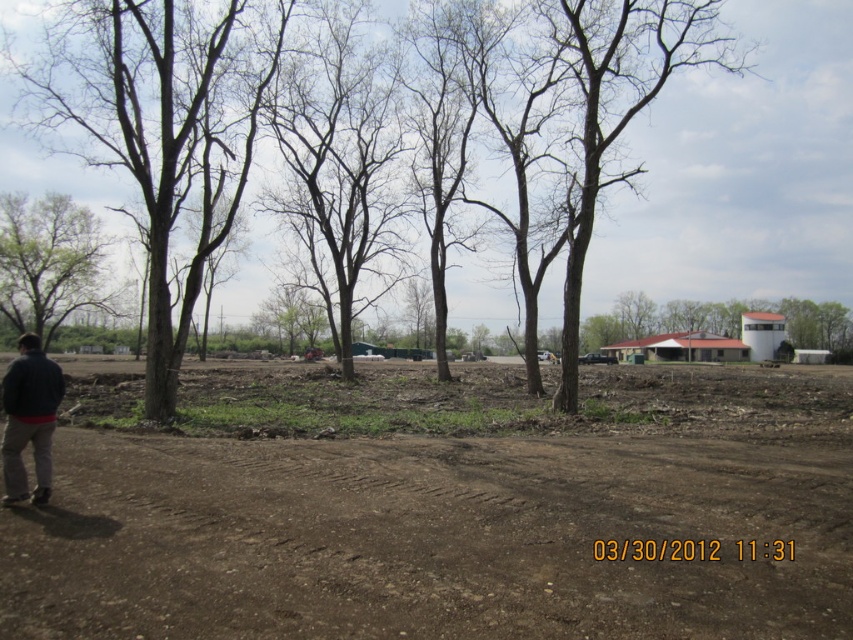
Question: Can you confirm if brown bark tree at center is bigger than green leafy tree at left?

Choices:
 (A) no
 (B) yes

Answer: (B)

Question: Can you confirm if green leafy tree at left is thinner than dark gray jacket at lower left?

Choices:
 (A) no
 (B) yes

Answer: (A)

Question: Is green leafy tree at left above dark gray jacket at lower left?

Choices:
 (A) yes
 (B) no

Answer: (A)

Question: Among these points, which one is nearest to the camera?

Choices:
 (A) (248, 13)
 (B) (4, 451)

Answer: (B)

Question: Among these points, which one is nearest to the camera?

Choices:
 (A) (48, 260)
 (B) (776, 483)
 (C) (148, 13)

Answer: (B)

Question: Considering the real-world distances, which object is farthest from the brown bark tree at center?

Choices:
 (A) dark gray jacket at lower left
 (B) brown dirt track at center

Answer: (A)